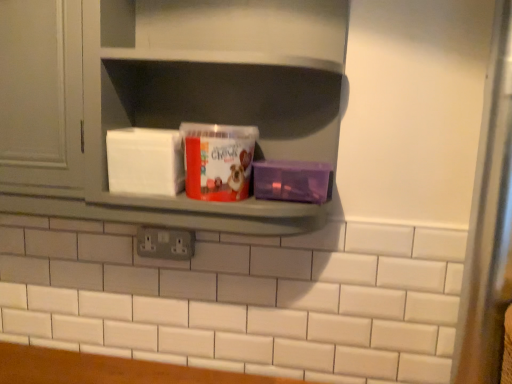
Question: Is gray plastic electric outlet at center closer to camera compared to matte gray cabinet at upper left?

Choices:
 (A) no
 (B) yes

Answer: (A)

Question: Considering the relative sizes of gray plastic electric outlet at center and matte gray cabinet at upper left in the image provided, is gray plastic electric outlet at center taller than matte gray cabinet at upper left?

Choices:
 (A) yes
 (B) no

Answer: (B)

Question: From the image's perspective, is gray plastic electric outlet at center on top of matte gray cabinet at upper left?

Choices:
 (A) yes
 (B) no

Answer: (B)

Question: Does gray plastic electric outlet at center have a smaller size compared to matte gray cabinet at upper left?

Choices:
 (A) yes
 (B) no

Answer: (A)

Question: Is gray plastic electric outlet at center wider than matte gray cabinet at upper left?

Choices:
 (A) no
 (B) yes

Answer: (A)

Question: Based on their positions, is matte gray shelf at center located to the left or right of matte plastic tub at center?

Choices:
 (A) left
 (B) right

Answer: (B)

Question: Looking at their shapes, would you say matte gray shelf at center is wider or thinner than matte plastic tub at center?

Choices:
 (A) thin
 (B) wide

Answer: (B)

Question: From the image's perspective, is matte gray shelf at center located above or below matte plastic tub at center?

Choices:
 (A) above
 (B) below

Answer: (A)

Question: Is matte gray shelf at center taller or shorter than matte plastic tub at center?

Choices:
 (A) tall
 (B) short

Answer: (A)

Question: From their relative heights in the image, would you say purple plastic container at right is taller or shorter than matte gray shelf at center?

Choices:
 (A) short
 (B) tall

Answer: (A)

Question: In terms of size, does purple plastic container at right appear bigger or smaller than matte gray shelf at center?

Choices:
 (A) small
 (B) big

Answer: (A)

Question: From the image's perspective, relative to matte gray shelf at center, is purple plastic container at right above or below?

Choices:
 (A) below
 (B) above

Answer: (A)

Question: Considering the positions of purple plastic container at right and matte gray shelf at center in the image, is purple plastic container at right wider or thinner than matte gray shelf at center?

Choices:
 (A) thin
 (B) wide

Answer: (A)

Question: Relative to matte plastic tub at center, is transparent glass door at right in front or behind?

Choices:
 (A) front
 (B) behind

Answer: (A)

Question: From the image's perspective, is transparent glass door at right positioned above or below matte plastic tub at center?

Choices:
 (A) below
 (B) above

Answer: (A)